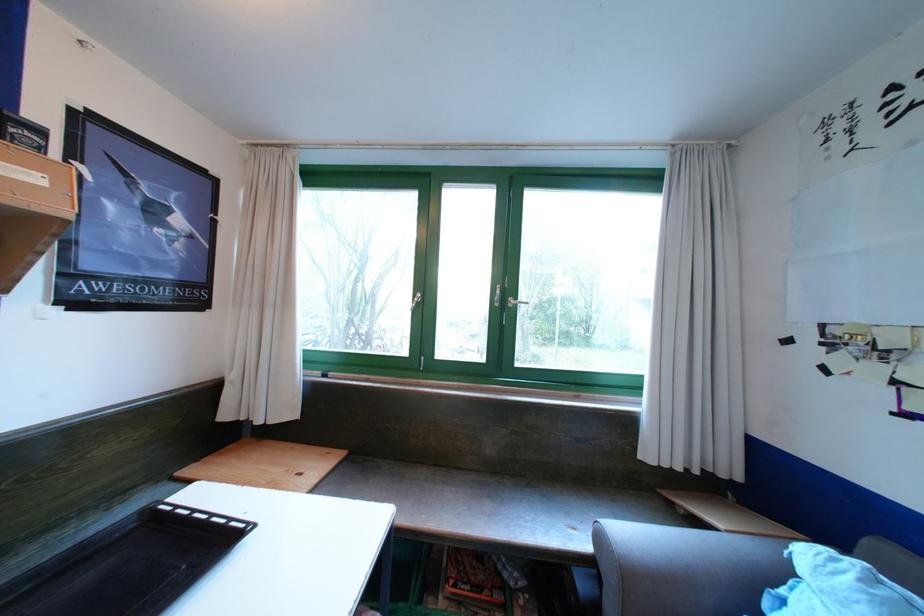
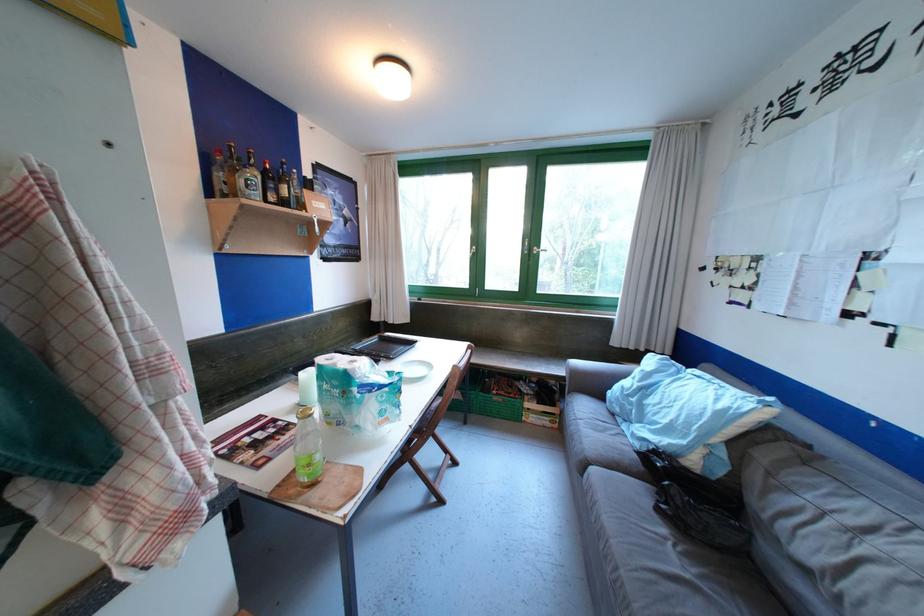
Where in the second image is the point corresponding to point (524, 300) from the first image?

(545, 249)